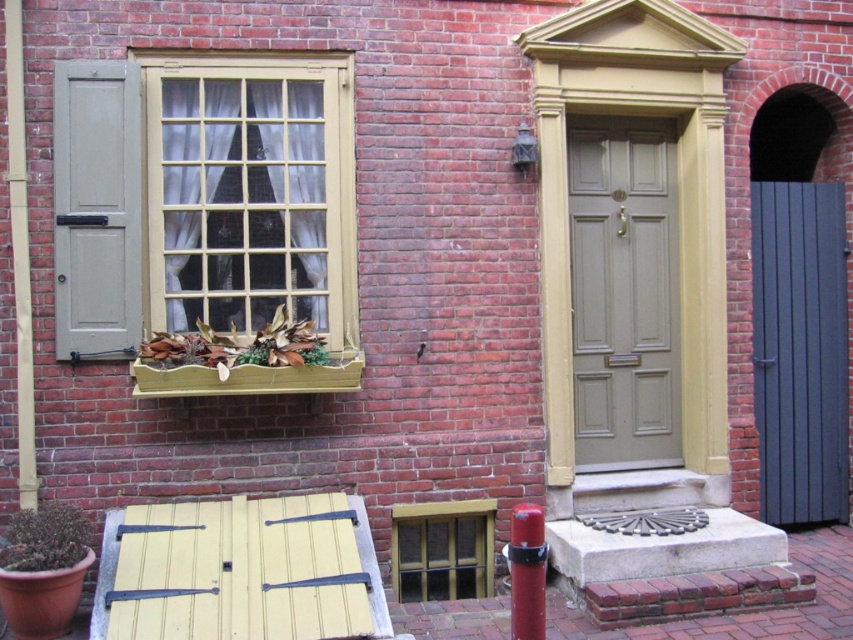
Can you confirm if wooden window at center is wider than wooden planter at lower left?

No.

Consider the image. Which is below, wooden window at center or wooden planter at lower left?

Positioned lower is wooden window at center.

You are a GUI agent. You are given a task and a screenshot of the screen. Output one action in this format:
    pyautogui.click(x=<x>, y=<y>)
    Task: Click on the wooden window at center
    The width and height of the screenshot is (853, 640).
    Given the screenshot: What is the action you would take?
    pyautogui.click(x=442, y=548)

The width and height of the screenshot is (853, 640). Find the location of `wooden window at center`. wooden window at center is located at coordinates (442, 548).

Consider the image. Between green matte plant at lower left and brown leafy plant at lower left, which one appears on the left side from the viewer's perspective?

green matte plant at lower left is more to the left.

Does point (62, 520) come farther from viewer compared to point (276, 364)?

That is False.

The width and height of the screenshot is (853, 640). I want to click on green matte plant at lower left, so click(45, 538).

Is brown leafy plant at window positioned before wooden planter at lower left?

Yes.

Can you confirm if brown leafy plant at window is positioned below wooden planter at lower left?

Actually, brown leafy plant at window is above wooden planter at lower left.

Is point (280, 365) behind point (199, 390)?

Yes, it is.

The image size is (853, 640). I want to click on brown leafy plant at window, so click(x=236, y=346).